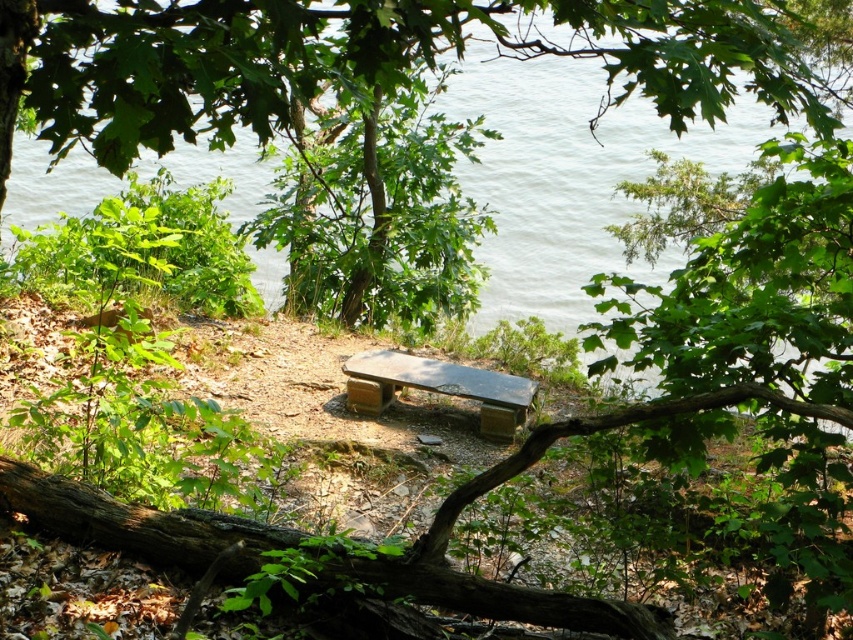
Is point (289, 44) more distant than point (497, 428)?

No, it is not.

Is green leafy tree at center further to the viewer compared to smooth wooden bench at center?

No, green leafy tree at center is in front of smooth wooden bench at center.

Is point (204, 52) positioned before point (515, 426)?

Yes, point (204, 52) is in front of point (515, 426).

Where is `green leafy tree at center`? The height and width of the screenshot is (640, 853). green leafy tree at center is located at coordinates (357, 61).